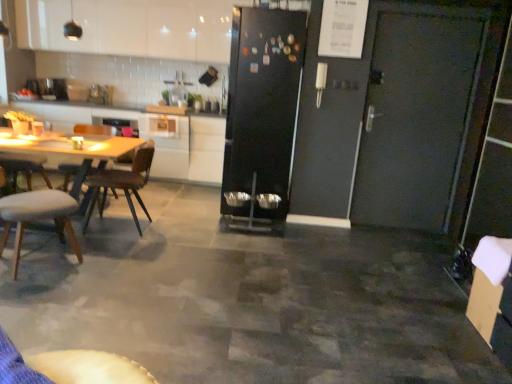
Question: Is the position of white glossy cabinet at upper left, which is counted as the second cabinetry, starting from the bottom, less distant than that of white leather chair at left, the second chair in the back-to-front sequence?

Choices:
 (A) no
 (B) yes

Answer: (A)

Question: Can you confirm if white glossy cabinet at upper left, which appears as the 1th cabinetry when viewed from the top, is positioned to the left of white leather chair at left, the second chair in the back-to-front sequence?

Choices:
 (A) yes
 (B) no

Answer: (B)

Question: Is white glossy cabinet at upper left, which is counted as the second cabinetry, starting from the bottom, shorter than white leather chair at left, which ranks as the first chair in front-to-back order?

Choices:
 (A) no
 (B) yes

Answer: (A)

Question: Is white glossy cabinet at upper left, which is counted as the second cabinetry, starting from the bottom, facing towards white leather chair at left, which ranks as the first chair in front-to-back order?

Choices:
 (A) yes
 (B) no

Answer: (B)

Question: From the image's perspective, is white glossy cabinet at upper left, which is counted as the second cabinetry, starting from the bottom, on top of white leather chair at left, which ranks as the first chair in front-to-back order?

Choices:
 (A) no
 (B) yes

Answer: (B)

Question: Considering the positions of white glossy cabinet at center, which is the 2th cabinetry in top-to-bottom order, and black matte refrigerator at center in the image, is white glossy cabinet at center, which is the 2th cabinetry in top-to-bottom order, taller or shorter than black matte refrigerator at center?

Choices:
 (A) tall
 (B) short

Answer: (B)

Question: Based on their sizes in the image, would you say white glossy cabinet at center, which is the 1th cabinetry from bottom to top, is bigger or smaller than black matte refrigerator at center?

Choices:
 (A) big
 (B) small

Answer: (B)

Question: Would you say white glossy cabinet at center, which is the 2th cabinetry in top-to-bottom order, is inside or outside black matte refrigerator at center?

Choices:
 (A) outside
 (B) inside

Answer: (A)

Question: From a real-world perspective, is white glossy cabinet at center, which is the 2th cabinetry in top-to-bottom order, positioned above or below black matte refrigerator at center?

Choices:
 (A) below
 (B) above

Answer: (A)

Question: Is brown wooden chair at left, arranged as the 1th chair when viewed from the back, in front of or behind white glossy countertop at upper left in the image?

Choices:
 (A) front
 (B) behind

Answer: (A)

Question: In terms of width, does brown wooden chair at left, the 2th chair when ordered from front to back, look wider or thinner when compared to white glossy countertop at upper left?

Choices:
 (A) wide
 (B) thin

Answer: (B)

Question: From the image's perspective, is brown wooden chair at left, the 2th chair when ordered from front to back, above or below white glossy countertop at upper left?

Choices:
 (A) below
 (B) above

Answer: (A)

Question: Considering the positions of point (101, 180) and point (215, 125), is point (101, 180) closer or farther from the camera than point (215, 125)?

Choices:
 (A) farther
 (B) closer

Answer: (B)

Question: Is black matte refrigerator at center inside the boundaries of brown wooden chair at left, the 2th chair when ordered from front to back, or outside?

Choices:
 (A) outside
 (B) inside

Answer: (A)

Question: Considering the positions of black matte refrigerator at center and brown wooden chair at left, arranged as the 1th chair when viewed from the back, in the image, is black matte refrigerator at center bigger or smaller than brown wooden chair at left, arranged as the 1th chair when viewed from the back,?

Choices:
 (A) small
 (B) big

Answer: (B)